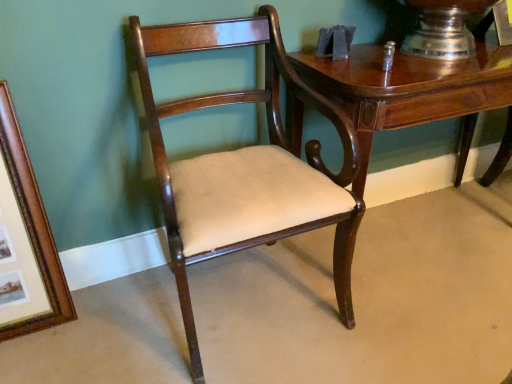
Find the location of a particular element. free space to the left of mahogany wood chair at center is located at coordinates (109, 325).